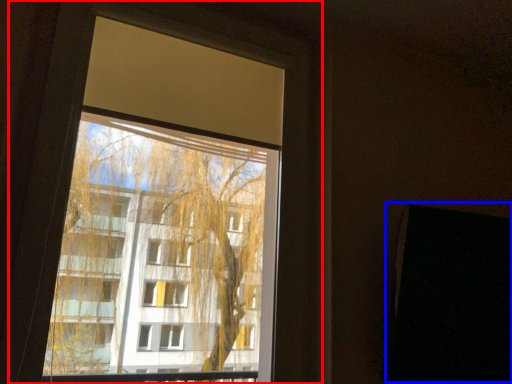
Question: Among these objects, which one is nearest to the camera, window (highlighted by a red box) or screen door (highlighted by a blue box)?

Choices:
 (A) window
 (B) screen door

Answer: (A)